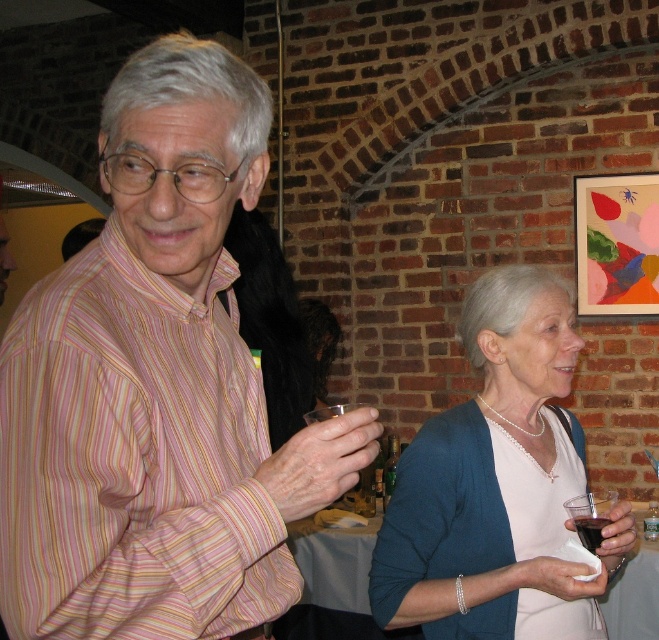
You are a guest at this event and notice both the pearl necklace at upper right and the transparent plastic cup at lower center. Which object would you say is bigger?

Result: The pearl necklace at upper right is larger in size than the transparent plastic cup at lower center.

You are standing in front of the brick wall and want to place two decorative items at the coordinates point (140, 392) and point (372, 497). Which coordinate is closer to you?

Point (140, 392) is closer to the viewer than point (372, 497).

You are a photographer trying to capture a closeup of the pearl necklace at upper right and the transparent plastic cup at lower center. Which object should you focus on first to ensure both are in focus?

The pearl necklace at upper right is closer to the viewer than the transparent plastic cup at lower center. To ensure both are in focus, you should focus on the transparent plastic cup at lower center first, as it is farther away and adjusting focus from there will help capture both objects within the depth of field.